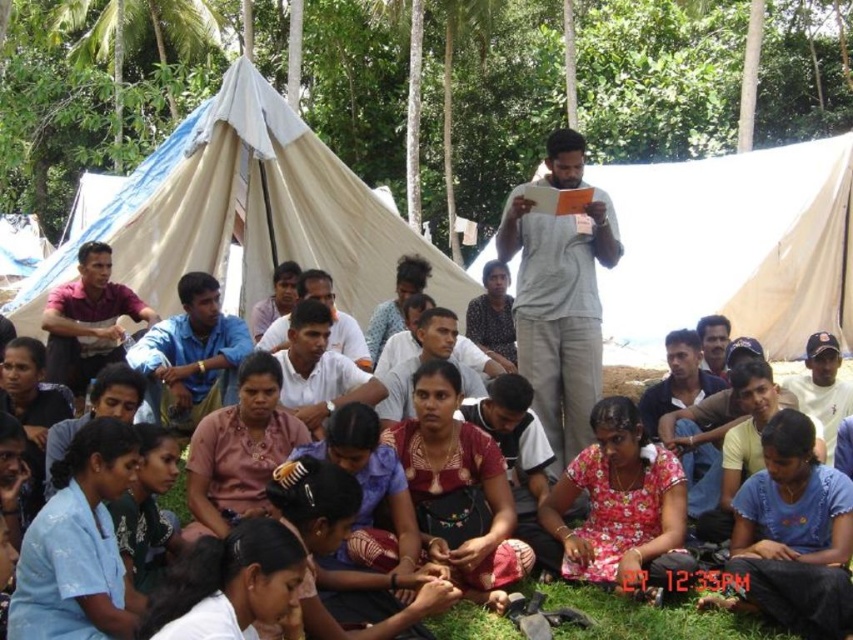
Question: Which point is farther to the camera?

Choices:
 (A) (106, 218)
 (B) (558, 419)

Answer: (A)

Question: Among these points, which one is nearest to the camera?

Choices:
 (A) (697, 275)
 (B) (523, 332)
 (C) (512, 636)
 (D) (291, 198)

Answer: (C)

Question: Can you confirm if beige canvas tent at center is bigger than green grass at lower center?

Choices:
 (A) yes
 (B) no

Answer: (A)

Question: Which object appears closest to the camera in this image?

Choices:
 (A) beige canvas tent at upper left
 (B) beige canvas tent at center
 (C) green grass at lower center
 (D) gray cotton shirt at center

Answer: (C)

Question: From the image, what is the correct spatial relationship of beige canvas tent at upper left in relation to green grass at lower center?

Choices:
 (A) above
 (B) below

Answer: (A)

Question: Does beige canvas tent at upper left have a larger size compared to green grass at lower center?

Choices:
 (A) no
 (B) yes

Answer: (B)